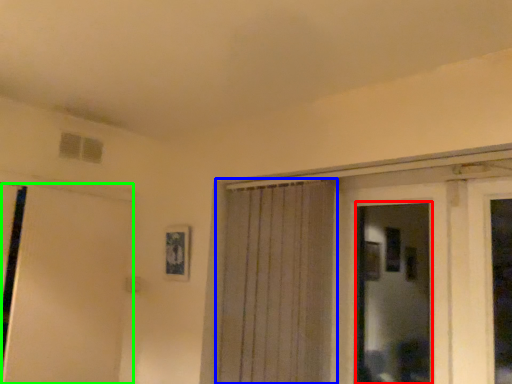
Question: Which object is positioned farthest from bay window (highlighted by a red box)? Select from curtain (highlighted by a blue box) and door (highlighted by a green box).

Choices:
 (A) curtain
 (B) door

Answer: (B)